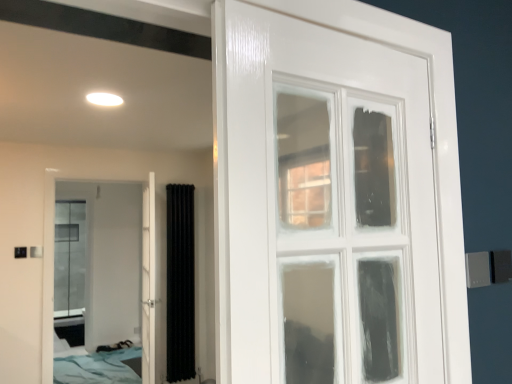
Question: Can you confirm if white glossy door at left, the first door in the left-to-right sequence, is taller than white glossy door at center, the first door positioned from the right?

Choices:
 (A) no
 (B) yes

Answer: (B)

Question: Can you confirm if white glossy door at left, the first door in the left-to-right sequence, is positioned to the right of white glossy door at center, the first door positioned from the right?

Choices:
 (A) yes
 (B) no

Answer: (B)

Question: From a real-world perspective, is white glossy door at left, which is the 2th door from right to left, located beneath white glossy door at center, the first door positioned from the right?

Choices:
 (A) yes
 (B) no

Answer: (B)

Question: Does white glossy door at left, the first door in the left-to-right sequence, have a smaller size compared to white glossy door at center, the first door positioned from the right?

Choices:
 (A) no
 (B) yes

Answer: (B)

Question: Considering the relative positions of white glossy door at left, the first door in the left-to-right sequence, and white glossy door at center, the 2th door from the left, in the image provided, is white glossy door at left, the first door in the left-to-right sequence, in front of white glossy door at center, the 2th door from the left,?

Choices:
 (A) yes
 (B) no

Answer: (B)

Question: Is white glossy door at left, the first door in the left-to-right sequence, facing away from white glossy door at center, the 2th door from the left?

Choices:
 (A) no
 (B) yes

Answer: (B)

Question: From the image's perspective, is black textured curtain at center below white glossy door at center, the 2th door from the left?

Choices:
 (A) yes
 (B) no

Answer: (A)

Question: Does black textured curtain at center contain white glossy door at center, the 2th door from the left?

Choices:
 (A) no
 (B) yes

Answer: (A)

Question: Is black textured curtain at center smaller than white glossy door at center, the 2th door from the left?

Choices:
 (A) yes
 (B) no

Answer: (A)

Question: From the image's perspective, is black textured curtain at center located above white glossy door at center, the 2th door from the left?

Choices:
 (A) no
 (B) yes

Answer: (A)

Question: Is black textured curtain at center far from white glossy door at center, the 2th door from the left?

Choices:
 (A) yes
 (B) no

Answer: (B)

Question: Is black textured curtain at center next to white glossy door at center, the first door positioned from the right, and touching it?

Choices:
 (A) no
 (B) yes

Answer: (A)

Question: Is white glossy door at center, the first door positioned from the right, facing away from blue fabric bed at lower left?

Choices:
 (A) yes
 (B) no

Answer: (B)